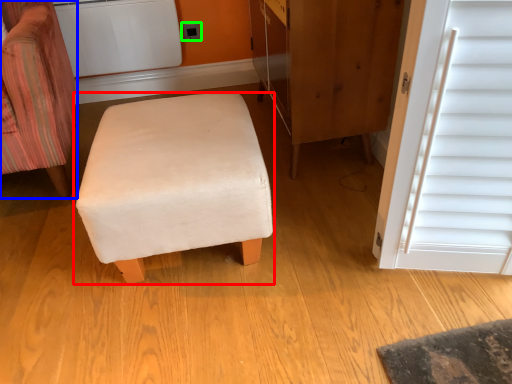
Question: Which is nearer to the furniture (highlighted by a red box)? chair (highlighted by a blue box) or electric outlet (highlighted by a green box).

Choices:
 (A) chair
 (B) electric outlet

Answer: (A)